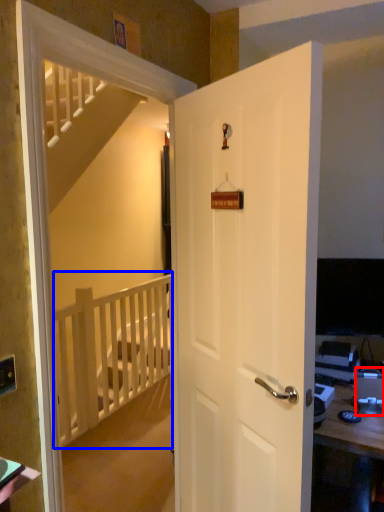
Question: Which object appears closest to the camera in this image, desktop computer (highlighted by a red box) or balustrade (highlighted by a blue box)?

Choices:
 (A) desktop computer
 (B) balustrade

Answer: (A)